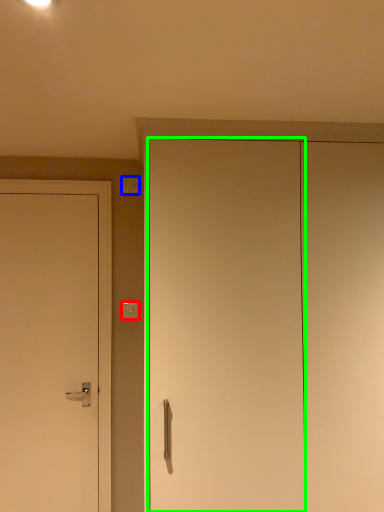
Question: Considering the real-world distances, which object is closest to light switch (highlighted by a red box)? light switch (highlighted by a blue box) or door (highlighted by a green box).

Choices:
 (A) light switch
 (B) door

Answer: (A)